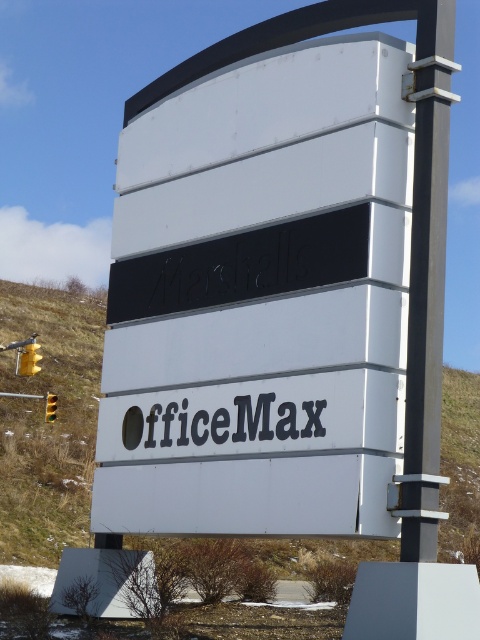
Can you confirm if grassy hillside at lower left is taller than black metal pole at upper center?

Correct, grassy hillside at lower left is much taller as black metal pole at upper center.

This screenshot has width=480, height=640. I want to click on grassy hillside at lower left, so click(x=48, y=422).